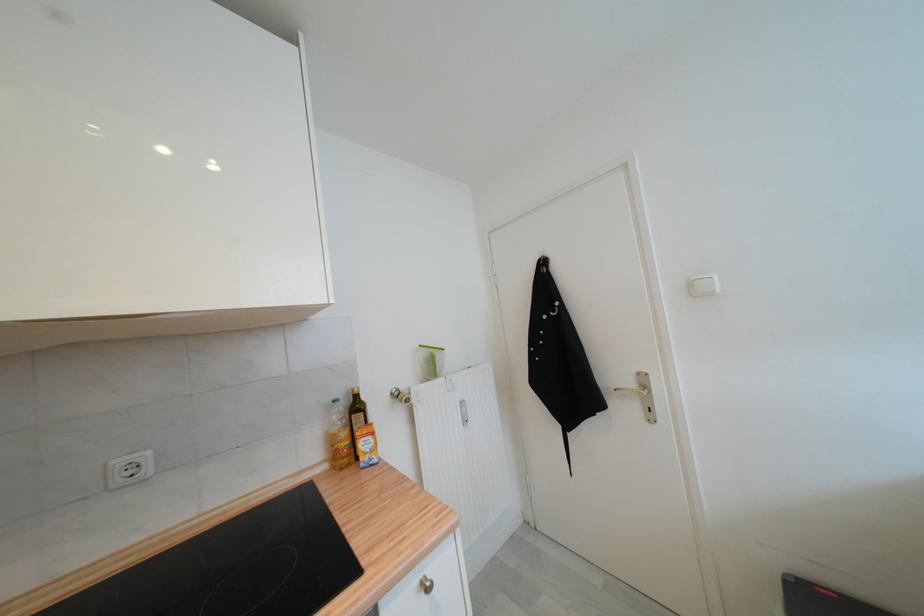
The image size is (924, 616). Describe the element at coordinates (357, 415) in the screenshot. I see `the green glass bottle` at that location.